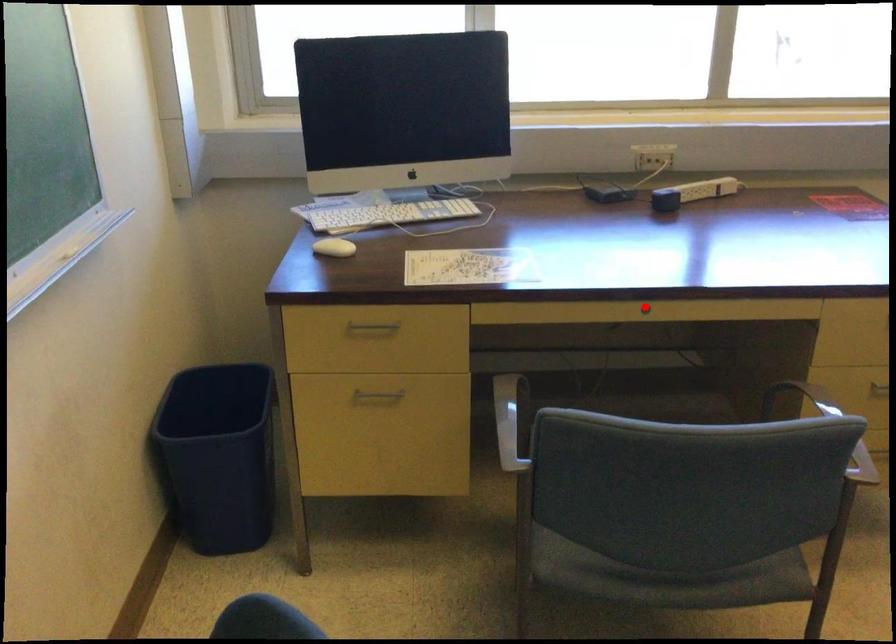
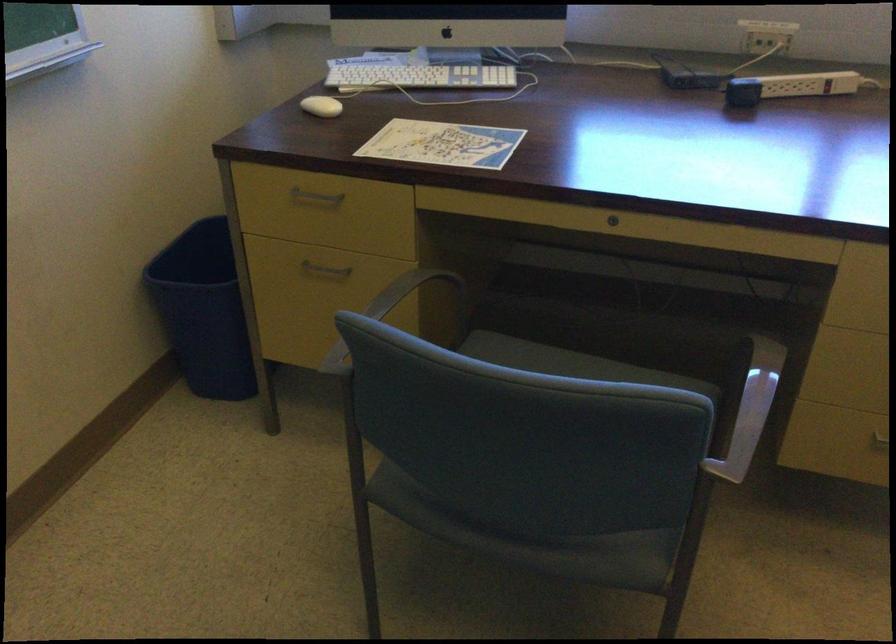
Where in the second image is the point corresponding to the highlighted location from the first image?

(613, 220)